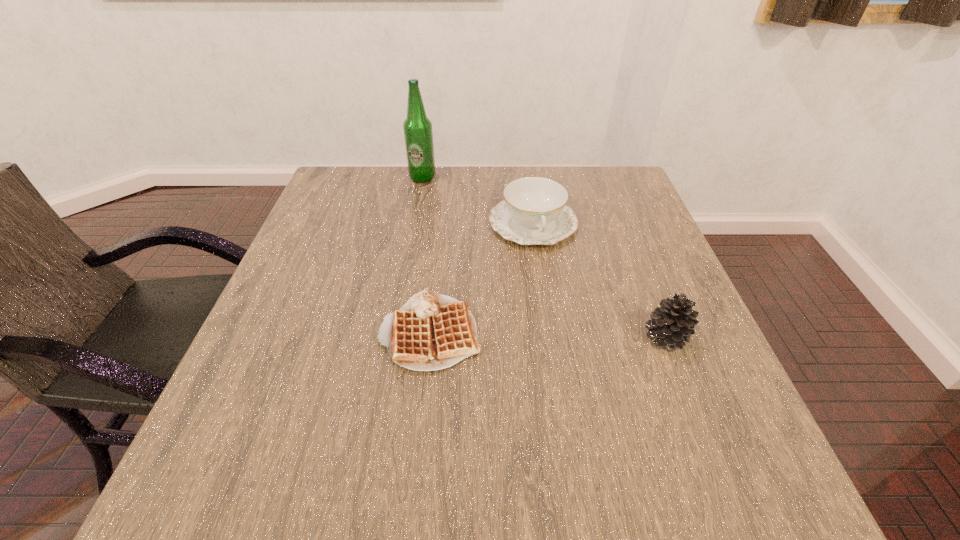
Where is `blank space located on the handle side of the third nearest object`? Image resolution: width=960 pixels, height=540 pixels. blank space located on the handle side of the third nearest object is located at coordinates (585, 382).

The height and width of the screenshot is (540, 960). Find the location of `vacant space located 0.060m on the handle side of the third nearest object`. vacant space located 0.060m on the handle side of the third nearest object is located at coordinates (547, 267).

Where is `vacant space located on the label of the tallest object`? vacant space located on the label of the tallest object is located at coordinates (460, 241).

The image size is (960, 540). Identify the location of vacant space located 0.360m on the label of the tallest object. (470, 259).

Locate an element on the screen. free space located on the label of the tallest object is located at coordinates (443, 211).

The width and height of the screenshot is (960, 540). Identify the location of chinaware at the far edge. (534, 211).

Image resolution: width=960 pixels, height=540 pixels. What are the coordinates of `beer bottle located in the far edge section of the desktop` in the screenshot? It's located at (418, 134).

Find the location of a particular element. Image resolution: width=960 pixels, height=540 pixels. object positioned at the right edge is located at coordinates (672, 324).

Identify the location of blank space at the far edge. (444, 189).

Identify the location of free space at the near edge of the desktop. The width and height of the screenshot is (960, 540). (512, 399).